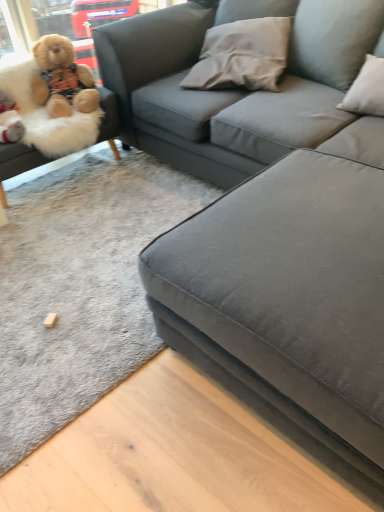
Question: Do you think gray fabric pillow at upper center is within fluffy beige teddy bear at left, which is counted as the first studio couch, starting from the left, or outside of it?

Choices:
 (A) inside
 (B) outside

Answer: (B)

Question: Would you say gray fabric pillow at upper center is to the left or to the right of fluffy beige teddy bear at left, which is counted as the first studio couch, starting from the left, in the picture?

Choices:
 (A) right
 (B) left

Answer: (A)

Question: Estimate the real-world distances between objects in this image. Which object is closer to the suede gray couch at center, which ranks as the 2th studio couch in left-to-right order?

Choices:
 (A) gray fabric pillow at upper center
 (B) fluffy beige teddy bear at upper left
 (C) fluffy beige teddy bear at left, the 2th studio couch viewed from the right

Answer: (A)

Question: Which object is positioned farthest from the suede gray couch at center, which ranks as the 2th studio couch in left-to-right order?

Choices:
 (A) fluffy beige teddy bear at upper left
 (B) fluffy beige teddy bear at left, the 2th studio couch viewed from the right
 (C) gray fabric pillow at upper center

Answer: (B)